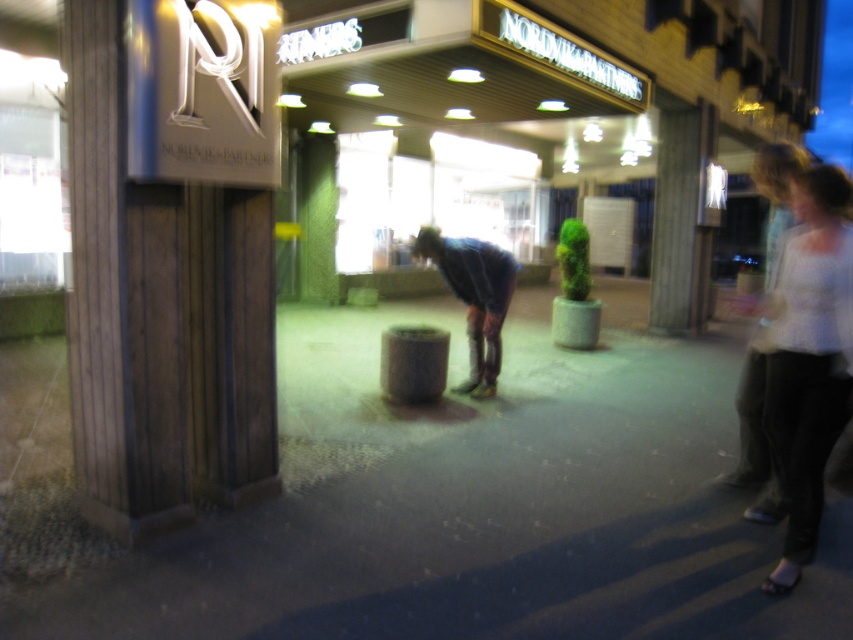
You are a delivery robot with a 3.5 feet wide package. You are positioned at the camera location and need to move forward to deliver the package to the smooth concrete pavement at center. Can you safely move forward without hitting any obstacles?

The smooth concrete pavement at center is 8.43 feet away from camera. Since the package is 3.5 feet wide, the robot can safely move forward as long as there are no obstacles in the path. However, the scene description mentions a person bending over near a cylindrical object to the right of the wooden structure. The robot should ensure there is enough space between itself and the person to avoid collision. The distance provided does not account for potential obstacles, so further assessment is needed.

You are standing in front of the wooden structure with the letter N. You see two points marked in the scene. Which point is closer to you, point (x=605, y=312) or point (x=677, y=157)?

Point (x=605, y=312) is further to the camera than point (x=677, y=157), so point (x=677, y=157) is closer to you.